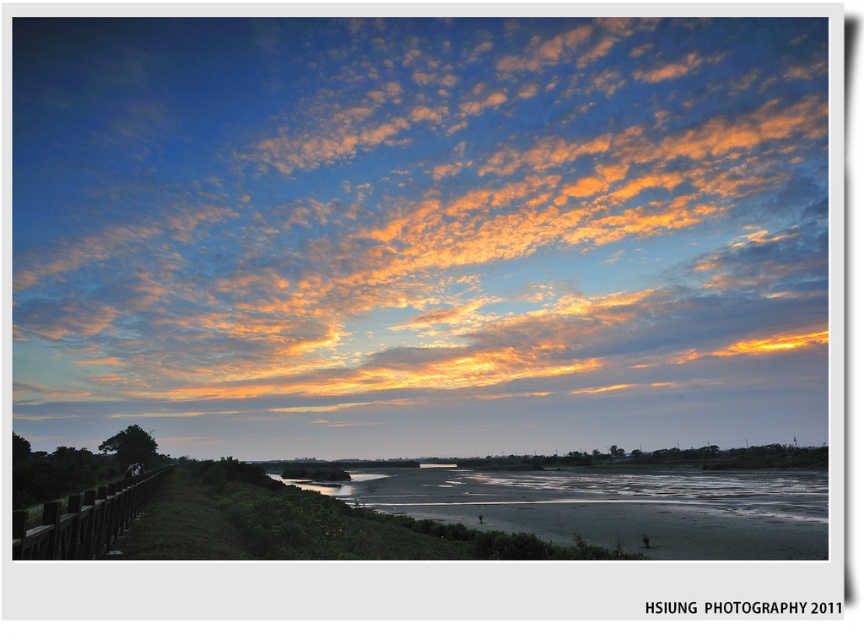
Identify the location of cloudy sky at upper center. This screenshot has width=864, height=640. (418, 224).

Does cloudy sky at upper center appear on the left side of sandy brown river at lower center?

Correct, you'll find cloudy sky at upper center to the left of sandy brown river at lower center.

The height and width of the screenshot is (640, 864). Describe the element at coordinates (418, 224) in the screenshot. I see `cloudy sky at upper center` at that location.

Identify the location of cloudy sky at upper center. The height and width of the screenshot is (640, 864). (418, 224).

Who is more forward, (677, 26) or (46, 540)?

Positioned in front is point (46, 540).

Does cloudy sky at upper center have a greater width compared to brown wooden fence at lower left?

Indeed, cloudy sky at upper center has a greater width compared to brown wooden fence at lower left.

Find the location of `cloudy sky at upper center`. cloudy sky at upper center is located at coordinates (418, 224).

Is sandy brown river at lower center above brown wooden fence at lower left?

Incorrect, sandy brown river at lower center is not positioned above brown wooden fence at lower left.

Who is taller, sandy brown river at lower center or brown wooden fence at lower left?

With more height is sandy brown river at lower center.

Describe the element at coordinates (613, 506) in the screenshot. This screenshot has width=864, height=640. I see `sandy brown river at lower center` at that location.

Where is `sandy brown river at lower center`? sandy brown river at lower center is located at coordinates (613, 506).